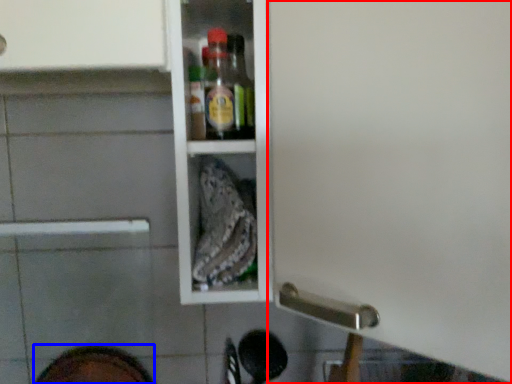
Question: Which object appears farthest to the camera in this image, screen door (highlighted by a red box) or footwear (highlighted by a blue box)?

Choices:
 (A) screen door
 (B) footwear

Answer: (B)